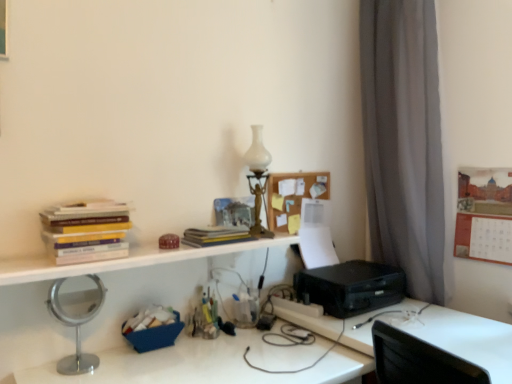
Question: Considering the positions of translucent plastic container at center, which is the second stationery in top-to-bottom order, and white glass table lamp at upper center in the image, is translucent plastic container at center, which is the second stationery in top-to-bottom order, taller or shorter than white glass table lamp at upper center?

Choices:
 (A) short
 (B) tall

Answer: (A)

Question: From the image's perspective, is translucent plastic container at center, which is the 2th stationery in bottom-to-top order, located above or below white glass table lamp at upper center?

Choices:
 (A) below
 (B) above

Answer: (A)

Question: Which is farther from the matte brown box at center, marked as the first stationery in a top-to-bottom arrangement?

Choices:
 (A) hardcover books at upper left
 (B) silver metallic mirror at left
 (C) wooden bulletin board at upper right
 (D) white matte bookshelf at upper center
 (E) black plastic printer at lower right

Answer: (C)

Question: Estimate the real-world distances between objects in this image. Which object is closer to the hardcover book at center?

Choices:
 (A) translucent plastic container at center, which is the second stationery in top-to-bottom order
 (B) blue fabric basket at lower left, the 3th stationery in the top-to-bottom sequence
 (C) wooden corkboard at upper center
 (D) matte brown box at center, which is the third stationery in bottom-to-top order
 (E) black plastic printer at right

Answer: (D)